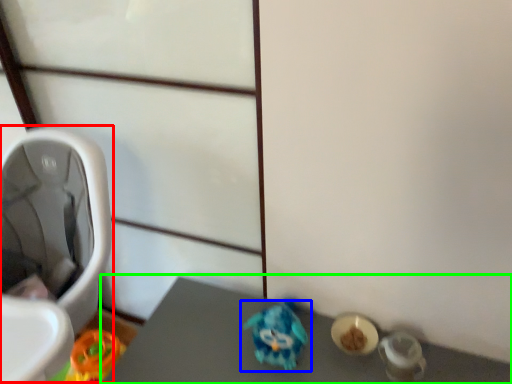
Question: Which object is the farthest from baby carriage (highlighted by a red box)? Choose among these: toy (highlighted by a blue box) or vanity (highlighted by a green box).

Choices:
 (A) toy
 (B) vanity

Answer: (A)